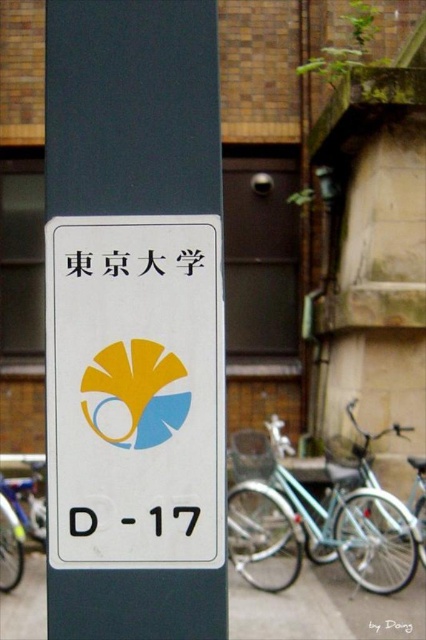
Question: Is light blue matte bicycle at center to the left of black plastic sign at center from the viewer's perspective?

Choices:
 (A) yes
 (B) no

Answer: (B)

Question: Observing the image, what is the correct spatial positioning of matte gray pole at center in reference to black plastic sign at center?

Choices:
 (A) left
 (B) right

Answer: (A)

Question: Which point is farther from the camera taking this photo?

Choices:
 (A) (411, 529)
 (B) (146, 161)

Answer: (A)

Question: In this image, where is black plastic sign at center located relative to black paper at upper center?

Choices:
 (A) below
 (B) above

Answer: (B)

Question: Among these points, which one is farthest from the camera?

Choices:
 (A) (19, 552)
 (B) (319, 502)
 (C) (68, 83)

Answer: (B)

Question: Which of these objects is positioned closest to the matte gray pole at center?

Choices:
 (A) black paper at upper center
 (B) gray concrete pavement at lower center
 (C) matte silver bicycle at left

Answer: (B)